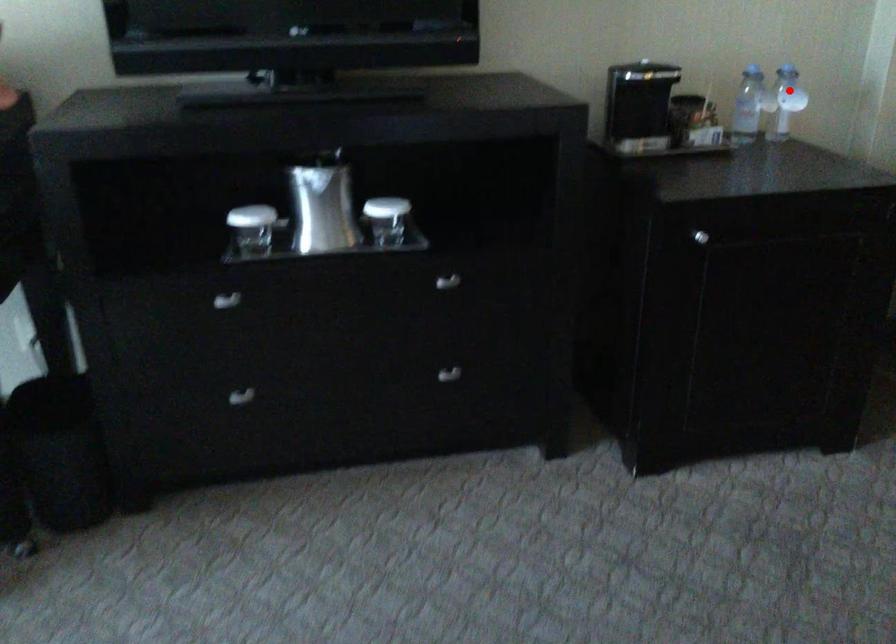
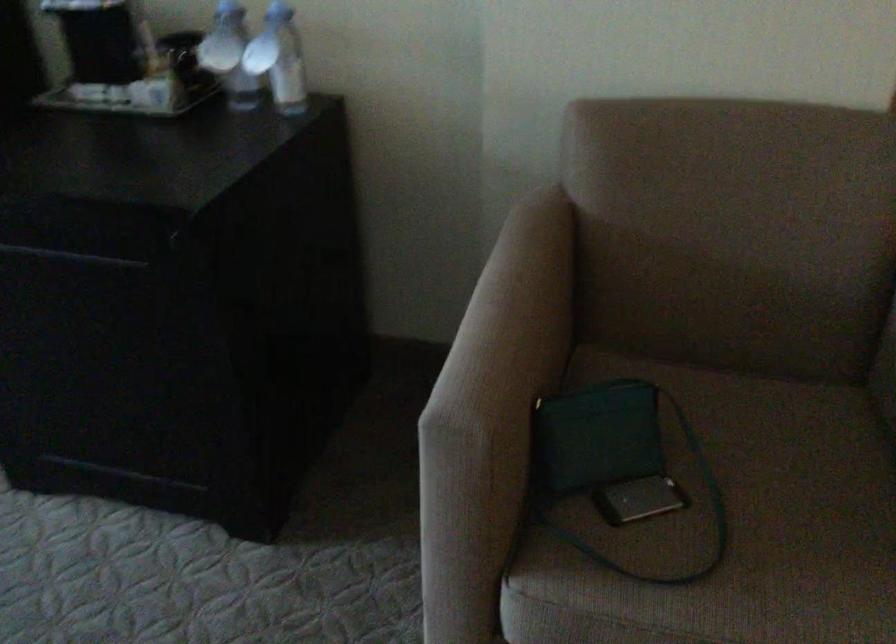
Question: I am providing you with two images of the same scene from different viewpoints. In image1, a red point is highlighted. Considering the same 3D point in image2, which of the following is correct?

Choices:
 (A) It is closer
 (B) It is farther

Answer: (A)